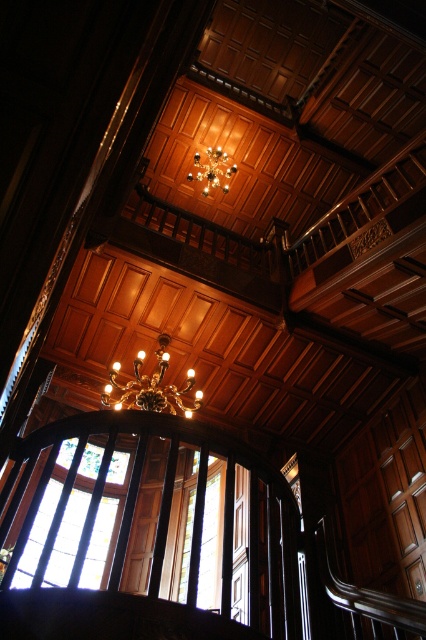
Image resolution: width=426 pixels, height=640 pixels. I want to click on clear glass window at center, so click(143, 522).

Is clear glass window at center smaller than gold metallic chandelier at upper center?

Actually, clear glass window at center might be larger than gold metallic chandelier at upper center.

Locate an element on the screen. The image size is (426, 640). clear glass window at center is located at coordinates (143, 522).

Who is positioned more to the right, clear glass window at center or gold metallic chandelier at center?

From the viewer's perspective, clear glass window at center appears more on the right side.

Does clear glass window at center come behind gold metallic chandelier at center?

No, it is not.

Does point (80, 556) come farther from viewer compared to point (150, 403)?

That is False.

You are a GUI agent. You are given a task and a screenshot of the screen. Output one action in this format:
    pyautogui.click(x=<x>, y=<y>)
    Task: Click on the clear glass window at center
    The height and width of the screenshot is (640, 426).
    Given the screenshot: What is the action you would take?
    pyautogui.click(x=143, y=522)

Is gold metallic chandelier at center to the right of gold metallic chandelier at upper center from the viewer's perspective?

No, gold metallic chandelier at center is not to the right of gold metallic chandelier at upper center.

Who is more distant from viewer, (184, 388) or (236, 164)?

The point (236, 164) is more distant.

Is point (175, 385) closer to camera compared to point (226, 177)?

Yes, it is.

Locate an element on the screen. This screenshot has height=640, width=426. gold metallic chandelier at center is located at coordinates (150, 387).